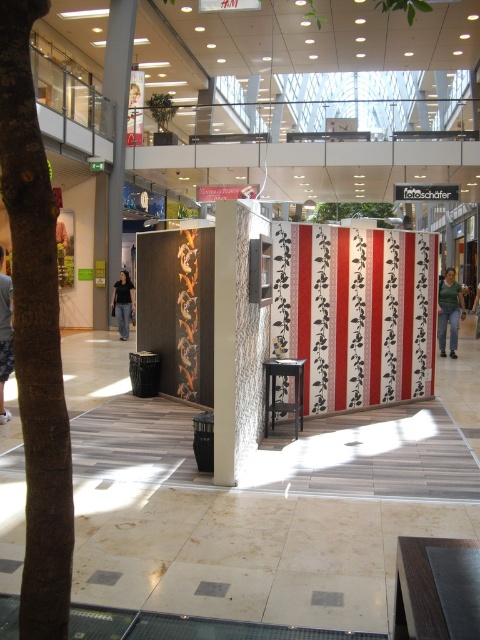
Question: Does brown rough bark tree at left have a larger size compared to green fabric at center?

Choices:
 (A) yes
 (B) no

Answer: (B)

Question: Which of the following is the closest to the observer?

Choices:
 (A) green fabric at center
 (B) white textured pillar at center
 (C) black jeans at center
 (D) wooden pillar at left

Answer: (B)

Question: Which point is farther to the camera?

Choices:
 (A) (474, 300)
 (B) (4, 180)

Answer: (A)

Question: Is brown rough bark tree at left wider than black glossy stool at center?

Choices:
 (A) yes
 (B) no

Answer: (B)

Question: Which point is farther to the camera?

Choices:
 (A) wooden pillar at left
 (B) brown rough bark tree at left

Answer: (A)

Question: Does brown rough bark tree at left have a smaller size compared to black glossy stool at center?

Choices:
 (A) no
 (B) yes

Answer: (B)